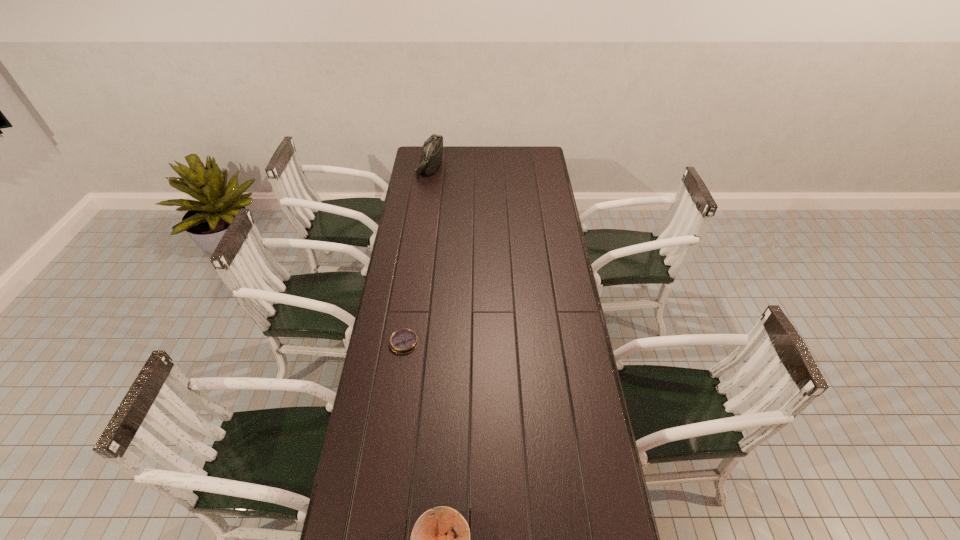
Locate an element on the screen. This screenshot has width=960, height=540. vacant space at the far edge of the desktop is located at coordinates (458, 157).

Identify the location of vacant space at the left edge of the desktop. The image size is (960, 540). (416, 265).

Identify the location of free region at the right edge of the desktop. (567, 486).

This screenshot has width=960, height=540. What are the coordinates of `vacant space at the far right corner of the desktop` in the screenshot? It's located at (535, 150).

Locate an element on the screen. vacant region between the shortest object and the farthest object is located at coordinates (418, 254).

At what (x,y) coordinates should I click in order to perform the action: click on object that is the closest one to the farthest object. Please return your answer as a coordinate pair (x, y). Image resolution: width=960 pixels, height=540 pixels. Looking at the image, I should click on (403, 341).

Select which object is the second closest to the shortest object. Please provide its 2D coordinates. Your answer should be formatted as a tuple, i.e. [(x, y)], where the tuple contains the x and y coordinates of a point satisfying the conditions above.

[(432, 150)]